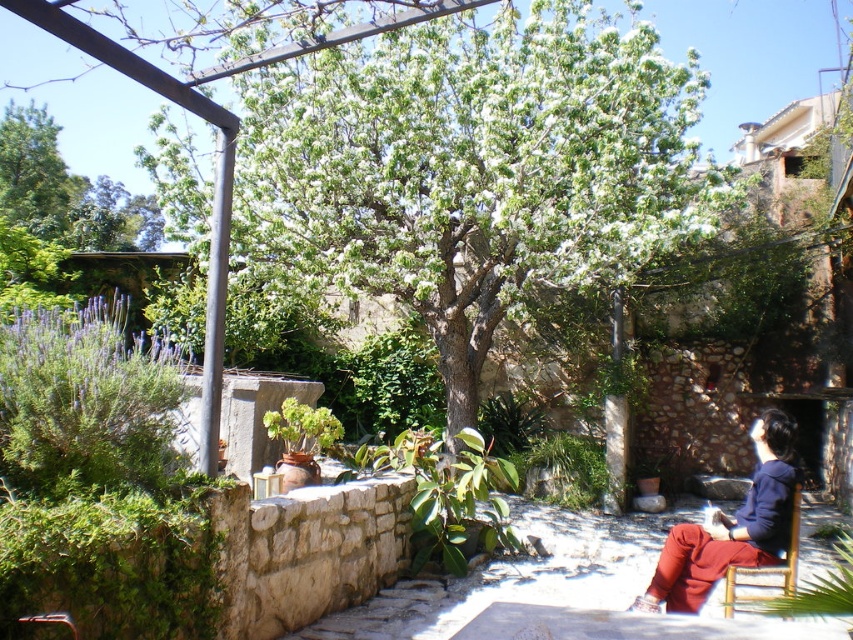
Question: Based on their relative distances, which object is nearer to the dark blue hoodie at lower right?

Choices:
 (A) wooden chair at lower right
 (B) green leafy tree at center

Answer: (A)

Question: Which is nearer to the green leafy tree at center?

Choices:
 (A) dark blue hoodie at lower right
 (B) wooden chair at lower right

Answer: (A)

Question: Which of the following is the closest to the observer?

Choices:
 (A) green leafy tree at center
 (B) wooden chair at lower right

Answer: (B)

Question: From the image, what is the correct spatial relationship of dark blue hoodie at lower right in relation to wooden chair at lower right?

Choices:
 (A) left
 (B) right

Answer: (A)

Question: Can you confirm if green leafy tree at center is wider than dark blue hoodie at lower right?

Choices:
 (A) no
 (B) yes

Answer: (B)

Question: Can you confirm if green leafy tree at center is positioned above dark blue hoodie at lower right?

Choices:
 (A) yes
 (B) no

Answer: (A)